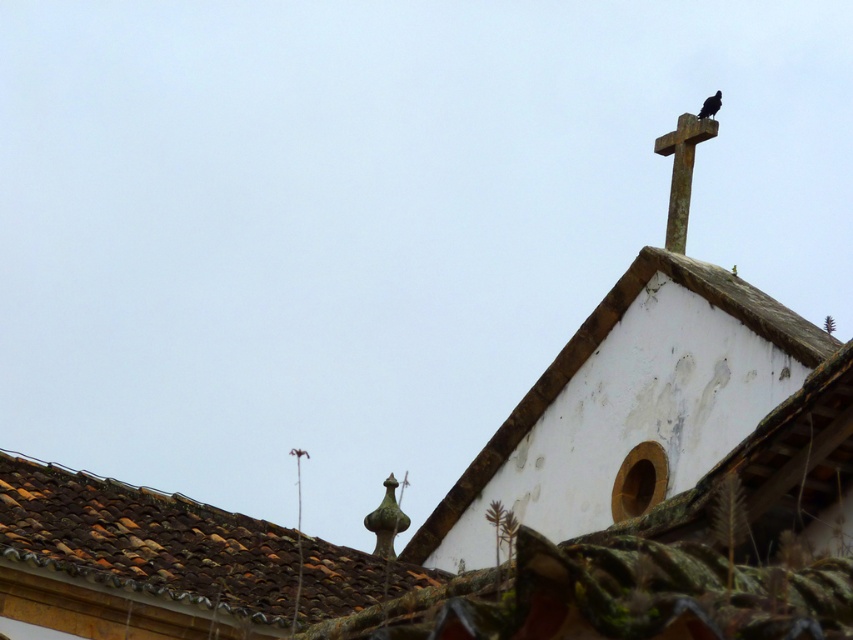
Looking at this image, you are standing in front of the building and want to determine which of the two points, point (682,225) or point (717,92), is closer to you. Based on the image, which point is nearer?

Point (682,225) is closer to the viewer than point (717,92).

You are standing on the ground looking at the building. The point marked at coordinates (134, 561) is located on the brown clay tiles at upper left. Which direction should you turn to face the brown clay tiles at upper left?

The point marked at coordinates (134, 561) is located on the brown clay tiles at upper left. Since you are standing on the ground looking at the building, turning to face the upper left would require turning to your left or upward, depending on your initial facing direction. However, without knowing your exact initial orientation, it is difficult to specify the exact direction. But based on the description, the brown clay tiles at upper left are positioned at the upper left area of the building, so you sh

Consider the image. You are an architect inspecting the roof and wall of an old building. You notice two objects on the upper right corner of the image. Which object is taller between the smooth stone cross at upper right and the black matte bird at upper right?

The smooth stone cross at upper right is much taller than the black matte bird at upper right.